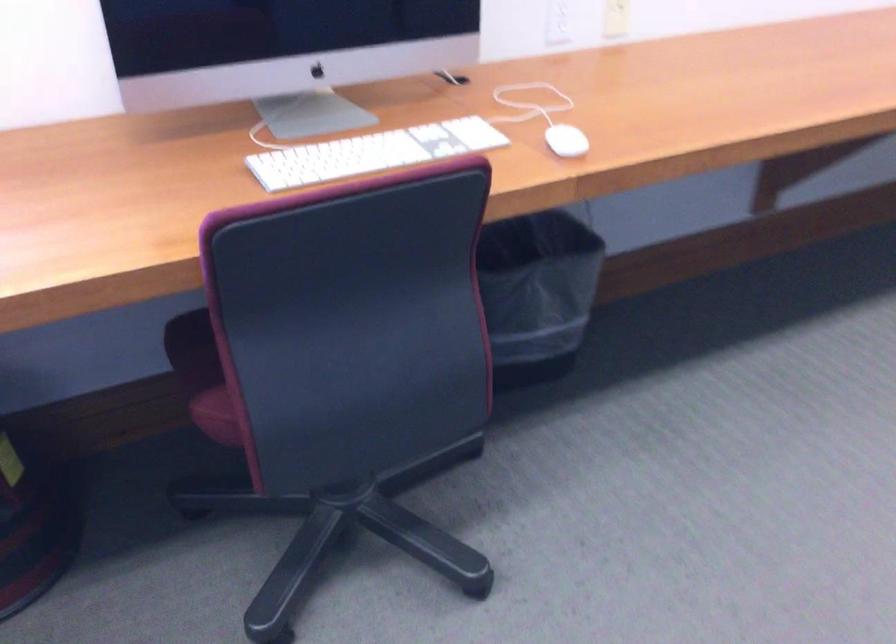
Where would you sit the chair sitting surface? Please return your answer as a coordinate pair (x, y).

(220, 413)